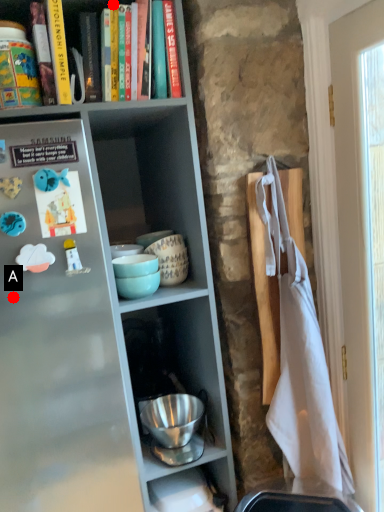
Question: Two points are circled on the image, labeled by A and B beside each circle. Which point is closer to the camera?

Choices:
 (A) A is closer
 (B) B is closer

Answer: (A)